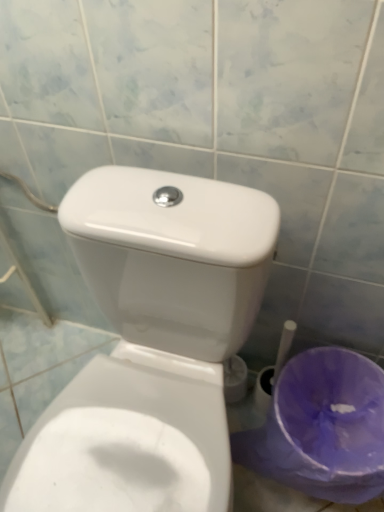
Describe the element at coordinates (334, 407) in the screenshot. The height and width of the screenshot is (512, 384). I see `purple plastic potty at lower right` at that location.

What is the approximate height of purple plastic potty at lower right?

10.83 inches.

At what (x,y) coordinates should I click in order to perform the action: click on purple plastic potty at lower right. Please return your answer as a coordinate pair (x, y). Looking at the image, I should click on (334, 407).

What is the approximate height of white glossy toilet at center?

white glossy toilet at center is 29.98 inches in height.

What do you see at coordinates (151, 344) in the screenshot? I see `white glossy toilet at center` at bounding box center [151, 344].

Identify the location of white glossy toilet at center. (151, 344).

Where is `purple plastic potty at lower right`? purple plastic potty at lower right is located at coordinates pos(334,407).

Based on the photo, does purple plastic potty at lower right appear on the right side of white glossy toilet at center?

Indeed, purple plastic potty at lower right is positioned on the right side of white glossy toilet at center.

Which object is closer to the camera, purple plastic potty at lower right or white glossy toilet at center?

white glossy toilet at center is closer to the camera.

Is point (352, 444) closer or farther from the camera than point (33, 449)?

Clearly, point (352, 444) is more distant from the camera than point (33, 449).

Consider the image. From the image's perspective, would you say purple plastic potty at lower right is positioned over white glossy toilet at center?

No, from the image's perspective, purple plastic potty at lower right is not above white glossy toilet at center.

From a real-world perspective, is purple plastic potty at lower right positioned under white glossy toilet at center based on gravity?

Indeed, from a real-world perspective, purple plastic potty at lower right is positioned beneath white glossy toilet at center.

Considering the relative sizes of purple plastic potty at lower right and white glossy toilet at center in the image provided, is purple plastic potty at lower right wider than white glossy toilet at center?

No.

Can you confirm if purple plastic potty at lower right is taller than white glossy toilet at center?

Incorrect, the height of purple plastic potty at lower right is not larger of that of white glossy toilet at center.

Can you confirm if purple plastic potty at lower right is bigger than white glossy toilet at center?

Incorrect, purple plastic potty at lower right is not larger than white glossy toilet at center.

Would you say purple plastic potty at lower right is outside white glossy toilet at center?

That's correct, purple plastic potty at lower right is outside of white glossy toilet at center.

Is purple plastic potty at lower right touching white glossy toilet at center?

purple plastic potty at lower right and white glossy toilet at center are not in contact.

Is purple plastic potty at lower right aimed at white glossy toilet at center?

No, purple plastic potty at lower right is not facing towards white glossy toilet at center.

How many degrees apart are the facing directions of purple plastic potty at lower right and white glossy toilet at center?

7.64e-05 degrees.

How distant is purple plastic potty at lower right from white glossy toilet at center?

The distance of purple plastic potty at lower right from white glossy toilet at center is 15.40 inches.

Locate an element on the screen. This screenshot has height=512, width=384. toilet in front of the purple plastic potty at lower right is located at coordinates (151, 344).

Between white glossy toilet at center and purple plastic potty at lower right, which one appears on the left side from the viewer's perspective?

Positioned to the left is white glossy toilet at center.

Considering their positions, is white glossy toilet at center located in front of or behind purple plastic potty at lower right?

Clearly, white glossy toilet at center is in front of purple plastic potty at lower right.

Which is behind, point (187, 310) or point (339, 355)?

The point (339, 355) is farther from the camera.

From the image's perspective, which is below, white glossy toilet at center or purple plastic potty at lower right?

purple plastic potty at lower right is shown below in the image.

From a real-world perspective, is white glossy toilet at center on top of purple plastic potty at lower right?

Indeed, from a real-world perspective, white glossy toilet at center stands above purple plastic potty at lower right.

Looking at their sizes, would you say white glossy toilet at center is wider or thinner than purple plastic potty at lower right?

In the image, white glossy toilet at center appears to be wider than purple plastic potty at lower right.

Is white glossy toilet at center taller or shorter than purple plastic potty at lower right?

Considering their sizes, white glossy toilet at center has more height than purple plastic potty at lower right.

Which of these two, white glossy toilet at center or purple plastic potty at lower right, is smaller?

purple plastic potty at lower right is smaller.

Is white glossy toilet at center inside or outside of purple plastic potty at lower right?

white glossy toilet at center exists outside the volume of purple plastic potty at lower right.

Are white glossy toilet at center and purple plastic potty at lower right located far from each other?

white glossy toilet at center is near purple plastic potty at lower right, not far away.

Is purple plastic potty at lower right at the back of white glossy toilet at center?

No, white glossy toilet at center is not facing away from purple plastic potty at lower right.

How many degrees apart are the facing directions of white glossy toilet at center and purple plastic potty at lower right?

They differ by 7.64e-05 degrees in their facing directions.

How distant is white glossy toilet at center from purple plastic potty at lower right?

15.40 inches.

The image size is (384, 512). What are the coordinates of `potty on the right of white glossy toilet at center` in the screenshot? It's located at (334, 407).

Locate an element on the screen. The height and width of the screenshot is (512, 384). toilet located on the left of purple plastic potty at lower right is located at coordinates (151, 344).

I want to click on potty on the right side of white glossy toilet at center, so click(334, 407).